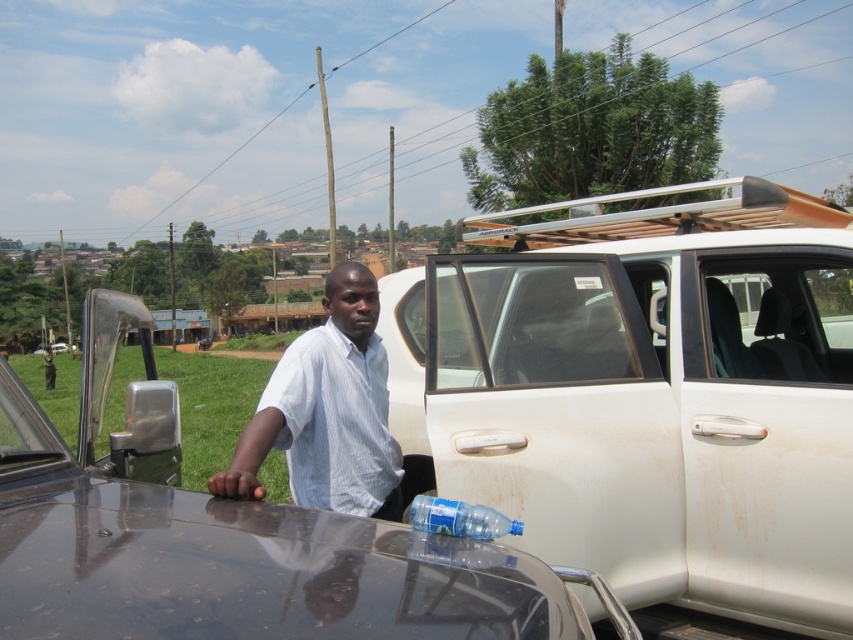
Which of these two, white matte van at center or white striped shirt at center, stands taller?

With more height is white matte van at center.

Does white matte van at center appear under white striped shirt at center?

No, white matte van at center is not below white striped shirt at center.

Identify the location of white matte van at center. Image resolution: width=853 pixels, height=640 pixels. (646, 394).

The height and width of the screenshot is (640, 853). I want to click on white matte car at center, so click(x=225, y=538).

Is white matte car at center to the left of translucent blue plastic bottle at lower center from the viewer's perspective?

Yes, white matte car at center is to the left of translucent blue plastic bottle at lower center.

Between point (24, 627) and point (480, 534), which one is positioned in front?

Point (24, 627) is in front.

Locate an element on the screen. white matte car at center is located at coordinates (225, 538).

Who is higher up, white matte van at center or white matte car at center?

white matte van at center is above.

Who is taller, white matte van at center or white matte car at center?

A: white matte car at center is taller.

Describe the element at coordinates (646, 394) in the screenshot. This screenshot has width=853, height=640. I see `white matte van at center` at that location.

Locate an element on the screen. Image resolution: width=853 pixels, height=640 pixels. white matte van at center is located at coordinates (646, 394).